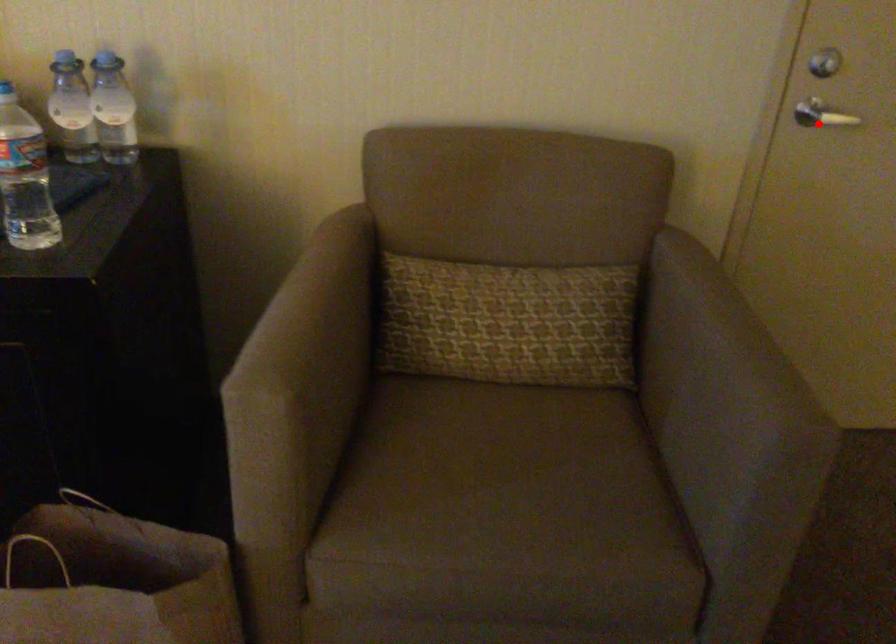
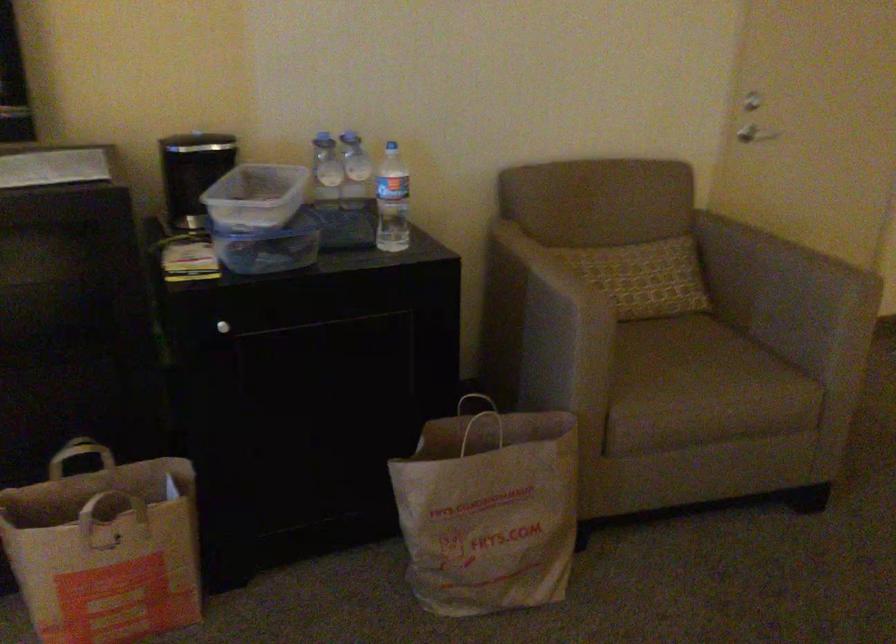
Find the pixel in the second image that matches the highlighted location in the first image.

(760, 135)